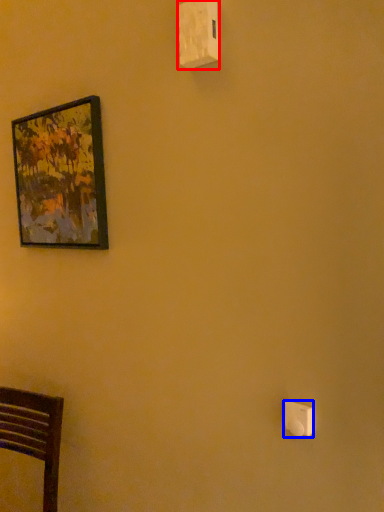
Question: Which of the following is the farthest to the observer, light switch (highlighted by a red box) or light switch (highlighted by a blue box)?

Choices:
 (A) light switch
 (B) light switch

Answer: (A)